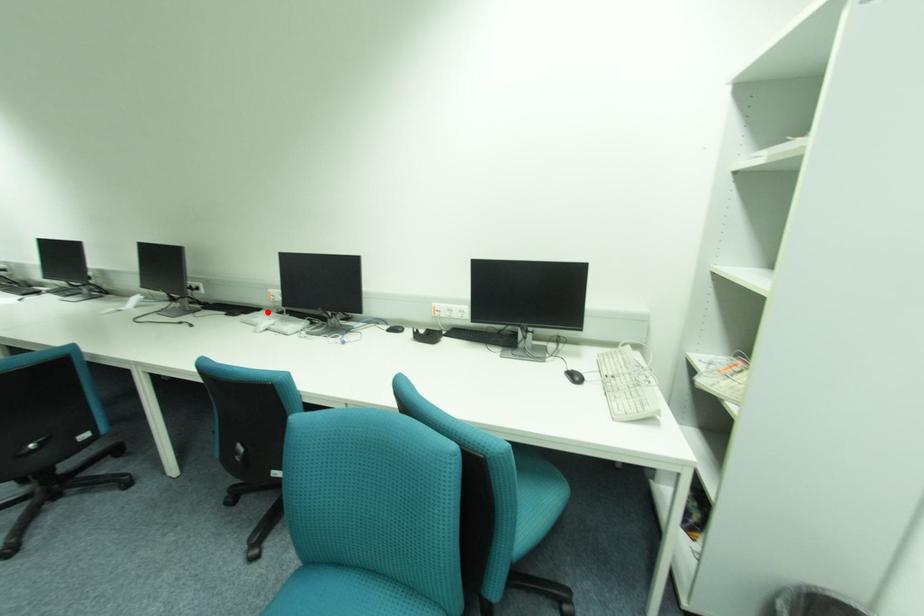
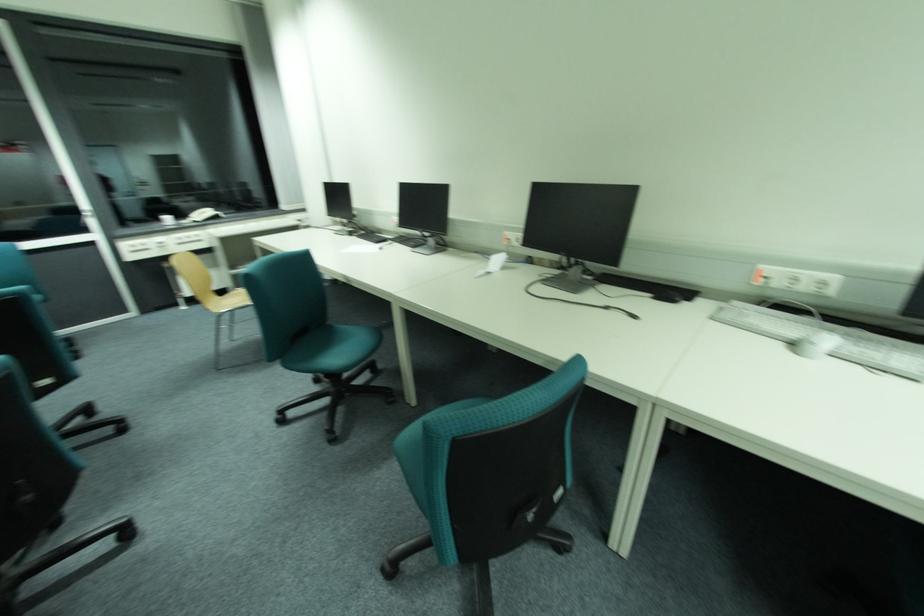
Where in the second image is the point corresponding to the highlighted location from the first image?

(743, 304)